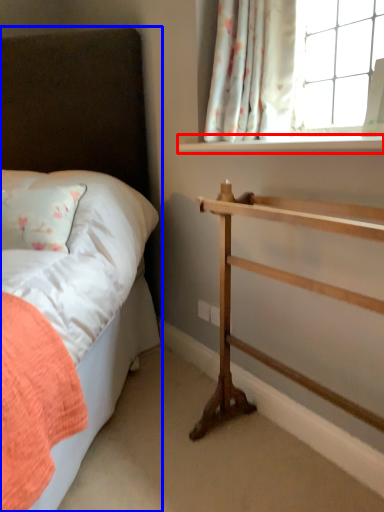
Question: Among these objects, which one is nearest to the camera, window sill (highlighted by a red box) or bed (highlighted by a blue box)?

Choices:
 (A) window sill
 (B) bed

Answer: (B)